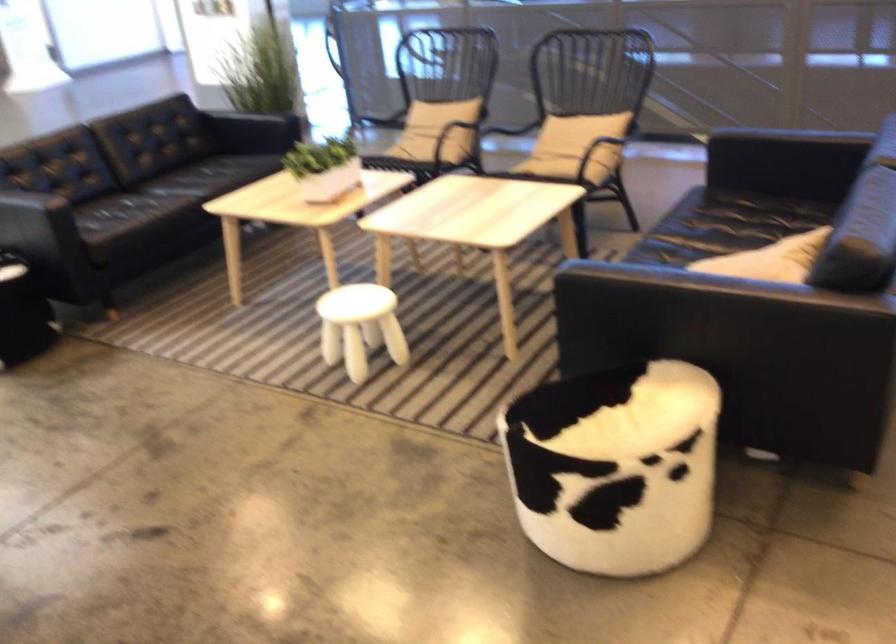
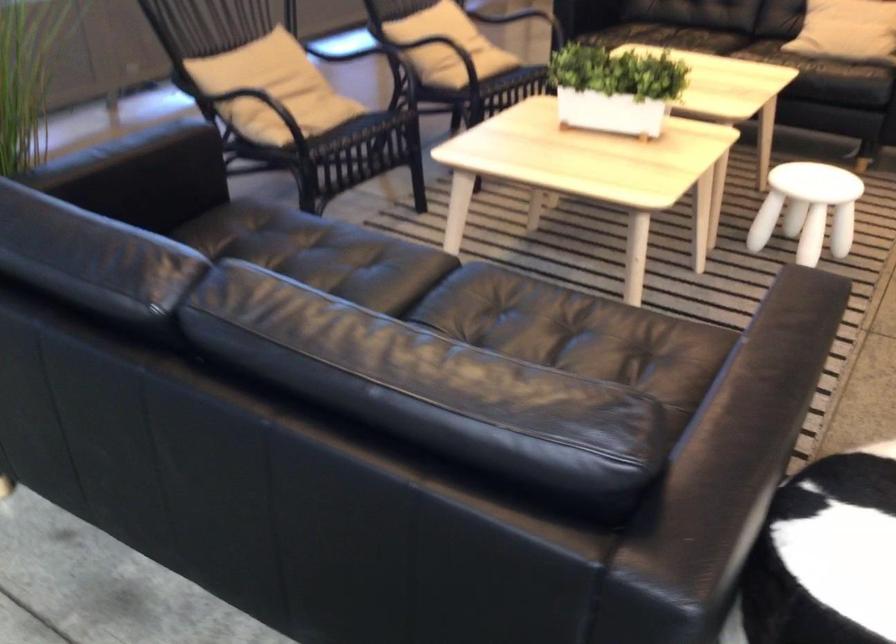
The point at (316,166) is marked in the first image. Where is the corresponding point in the second image?

(615, 88)